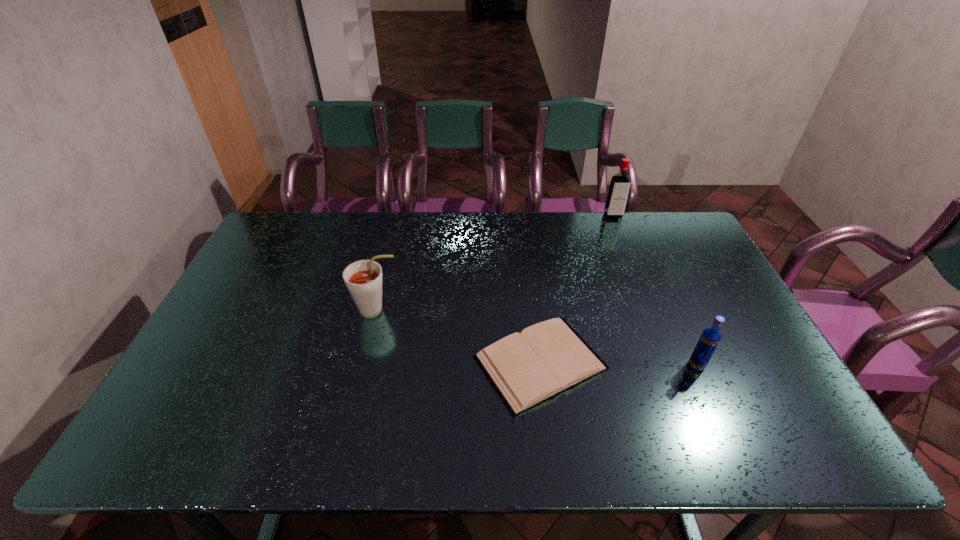
The height and width of the screenshot is (540, 960). I want to click on vacant space situated on the front of the shortest object, so click(549, 437).

Identify the location of object present at the far edge. (618, 192).

In the image, there is a desktop. Identify the location of vacant space at the far edge. The image size is (960, 540). (x=349, y=218).

Locate an element on the screen. free spot at the near edge of the desktop is located at coordinates (691, 431).

In the image, there is a desktop. Identify the location of free space at the left edge. (279, 279).

At what (x,y) coordinates should I click in order to perform the action: click on vacant space at the right edge of the desktop. Please return your answer as a coordinate pair (x, y). Image resolution: width=960 pixels, height=540 pixels. Looking at the image, I should click on (697, 332).

This screenshot has height=540, width=960. In order to click on blank space at the far left corner in this screenshot , I will do `click(289, 234)`.

This screenshot has width=960, height=540. Identify the location of free spot between the left vodka and the root beer. (495, 262).

Locate an element on the screen. Image resolution: width=960 pixels, height=540 pixels. vacant region between the hardback book and the right vodka is located at coordinates [x=618, y=364].

Locate an element on the screen. vacant space that's between the root beer and the third object from left to right is located at coordinates (495, 262).